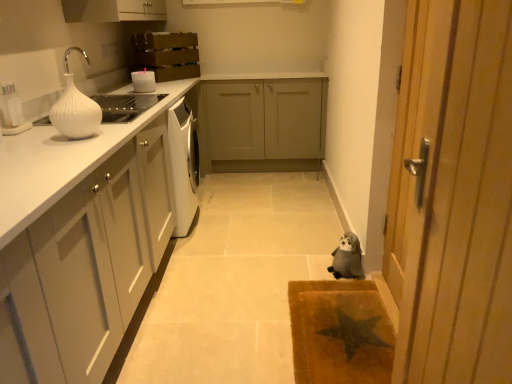
Question: Does fluffy gray stuffed animal at lower right have a greater height compared to matte gray cabinets at center, the 1th cabinetry when ordered from back to front?

Choices:
 (A) no
 (B) yes

Answer: (A)

Question: Can you confirm if fluffy gray stuffed animal at lower right is smaller than matte gray cabinets at center, the third cabinetry viewed from the front?

Choices:
 (A) no
 (B) yes

Answer: (B)

Question: Is fluffy gray stuffed animal at lower right aimed at matte gray cabinets at center, the 1th cabinetry when ordered from back to front?

Choices:
 (A) no
 (B) yes

Answer: (A)

Question: From a real-world perspective, is fluffy gray stuffed animal at lower right physically below matte gray cabinets at center, the third cabinetry viewed from the front?

Choices:
 (A) yes
 (B) no

Answer: (A)

Question: Considering the relative sizes of fluffy gray stuffed animal at lower right and matte gray cabinets at center, the 1th cabinetry when ordered from back to front, in the image provided, is fluffy gray stuffed animal at lower right bigger than matte gray cabinets at center, the 1th cabinetry when ordered from back to front,?

Choices:
 (A) no
 (B) yes

Answer: (A)

Question: Choose the correct answer: Is white ribbed vase at left inside white glossy knife block at upper left, which ranks as the first appliance in bottom-to-top order, or outside it?

Choices:
 (A) outside
 (B) inside

Answer: (A)

Question: Considering the positions of white ribbed vase at left and white glossy knife block at upper left, the 2th appliance from the top, in the image, is white ribbed vase at left bigger or smaller than white glossy knife block at upper left, the 2th appliance from the top,?

Choices:
 (A) big
 (B) small

Answer: (A)

Question: Relative to white glossy knife block at upper left, the 2th appliance from the top, is white ribbed vase at left in front or behind?

Choices:
 (A) front
 (B) behind

Answer: (A)

Question: From a real-world perspective, is white ribbed vase at left physically located above or below white glossy knife block at upper left, which ranks as the first appliance in bottom-to-top order?

Choices:
 (A) below
 (B) above

Answer: (B)

Question: Considering the positions of white ribbed vase at left and matte gray cabinets at center, the 1th cabinetry when ordered from back to front, in the image, is white ribbed vase at left wider or thinner than matte gray cabinets at center, the 1th cabinetry when ordered from back to front,?

Choices:
 (A) thin
 (B) wide

Answer: (A)

Question: From the image's perspective, is white ribbed vase at left located above or below matte gray cabinets at center, the third cabinetry viewed from the front?

Choices:
 (A) below
 (B) above

Answer: (A)

Question: Is white ribbed vase at left in front of or behind matte gray cabinets at center, the third cabinetry viewed from the front, in the image?

Choices:
 (A) behind
 (B) front

Answer: (B)

Question: Does point (90, 120) appear closer or farther from the camera than point (259, 115)?

Choices:
 (A) closer
 (B) farther

Answer: (A)

Question: Is white glossy knife block at upper left, which ranks as the 1th appliance in front-to-back order, spatially inside beige textured mat at lower right, or outside of it?

Choices:
 (A) outside
 (B) inside

Answer: (A)

Question: Looking at the image, does white glossy knife block at upper left, acting as the 2th appliance starting from the right, seem bigger or smaller compared to beige textured mat at lower right?

Choices:
 (A) small
 (B) big

Answer: (A)